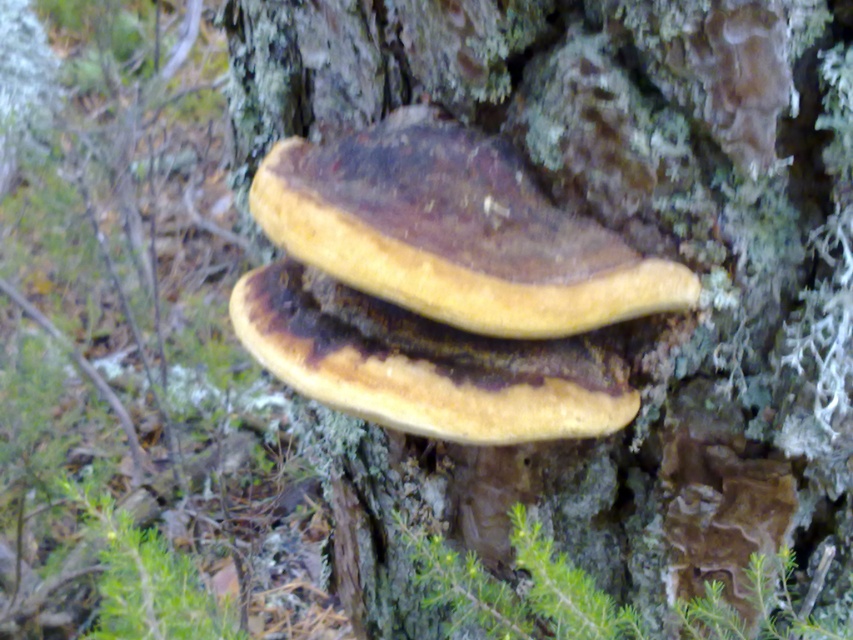
Question: In this image, where is brown leathery fungus at center located relative to yellowish-brown wood at center?

Choices:
 (A) below
 (B) above

Answer: (B)

Question: Which object appears closest to the camera in this image?

Choices:
 (A) brown leathery fungus at center
 (B) yellowish-brown wood at center
 (C) brown/corky mushroom at center

Answer: (A)

Question: Can you confirm if brown/corky mushroom at center is positioned to the right of yellowish-brown wood at center?

Choices:
 (A) no
 (B) yes

Answer: (B)

Question: Which of the following is the closest to the observer?

Choices:
 (A) brown leathery fungus at center
 (B) brown/corky mushroom at center
 (C) yellowish-brown wood at center

Answer: (A)

Question: Can you confirm if brown/corky mushroom at center is positioned above brown leathery fungus at center?

Choices:
 (A) yes
 (B) no

Answer: (B)

Question: Which object is the closest to the brown leathery fungus at center?

Choices:
 (A) brown/corky mushroom at center
 (B) yellowish-brown wood at center

Answer: (B)